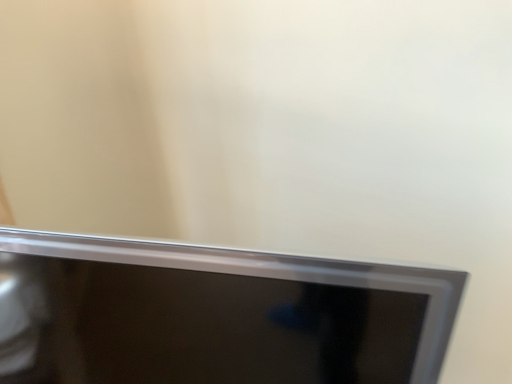
Where is `satin black screen at bottom`? Image resolution: width=512 pixels, height=384 pixels. satin black screen at bottom is located at coordinates (214, 315).

What do you see at coordinates (214, 315) in the screenshot?
I see `satin black screen at bottom` at bounding box center [214, 315].

What is the approximate height of satin black screen at bottom?

20.05 inches.

At what (x,y) coordinates should I click in order to perform the action: click on satin black screen at bottom. Please return your answer as a coordinate pair (x, y). Looking at the image, I should click on (214, 315).